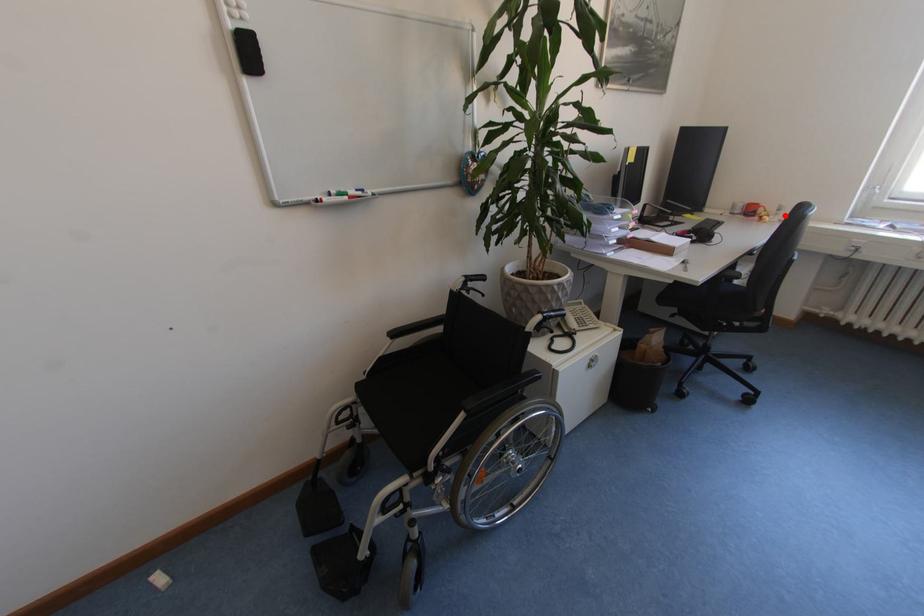
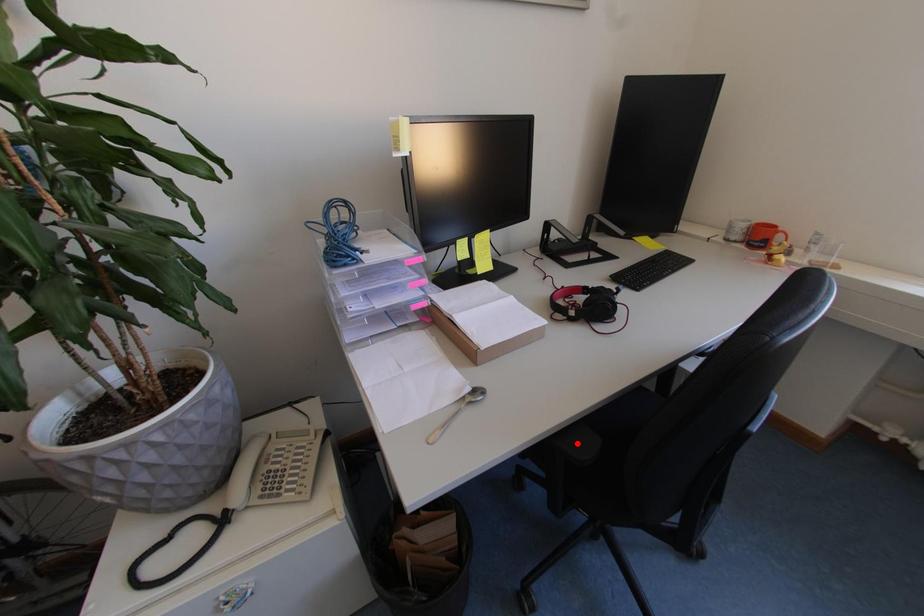
I am providing you with two images of the same scene from different viewpoints. A red point is marked on the first image and another point is marked on the second image. Do the highlighted points in image1 and image2 indicate the same real-world spot?

No